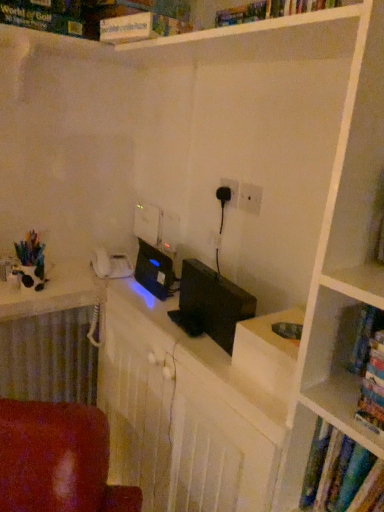
Question: Is white matte puzzle box at upper center placed right next to white textured radiator at lower left?

Choices:
 (A) no
 (B) yes

Answer: (A)

Question: Does white matte puzzle box at upper center have a lesser height compared to white textured radiator at lower left?

Choices:
 (A) no
 (B) yes

Answer: (B)

Question: Can you confirm if white matte puzzle box at upper center is wider than white textured radiator at lower left?

Choices:
 (A) no
 (B) yes

Answer: (B)

Question: Can you confirm if white matte puzzle box at upper center is taller than white textured radiator at lower left?

Choices:
 (A) no
 (B) yes

Answer: (A)

Question: Can white textured radiator at lower left be found inside white matte puzzle box at upper center?

Choices:
 (A) yes
 (B) no

Answer: (B)

Question: From a real-world perspective, is white matte puzzle box at upper center over white textured radiator at lower left?

Choices:
 (A) no
 (B) yes

Answer: (B)

Question: Is white plastic electric outlet at center, acting as the first electric outlet starting from the right, positioned with its back to black plastic electric outlet at center, acting as the second electric outlet starting from the front?

Choices:
 (A) no
 (B) yes

Answer: (A)

Question: Considering the relative sizes of white plastic electric outlet at center, which appears as the 1th electric outlet when viewed from the front, and black plastic electric outlet at center, the second electric outlet from the right, in the image provided, is white plastic electric outlet at center, which appears as the 1th electric outlet when viewed from the front, shorter than black plastic electric outlet at center, the second electric outlet from the right,?

Choices:
 (A) no
 (B) yes

Answer: (B)

Question: From a real-world perspective, is white plastic electric outlet at center, the 2th electric outlet viewed from the left, below black plastic electric outlet at center, positioned as the 1th electric outlet in left-to-right order?

Choices:
 (A) yes
 (B) no

Answer: (A)

Question: Would you say white plastic electric outlet at center, which ranks as the second electric outlet in back-to-front order, is a long distance from black plastic electric outlet at center, positioned as the 1th electric outlet in left-to-right order?

Choices:
 (A) no
 (B) yes

Answer: (A)

Question: From the image's perspective, is white plastic electric outlet at center, which appears as the 1th electric outlet when viewed from the front, under black plastic electric outlet at center, the second electric outlet from the right?

Choices:
 (A) no
 (B) yes

Answer: (B)

Question: Is white plastic electric outlet at center, which ranks as the second electric outlet in back-to-front order, placed right next to black plastic electric outlet at center, acting as the second electric outlet starting from the front?

Choices:
 (A) yes
 (B) no

Answer: (A)

Question: Considering the relative sizes of white matte puzzle box at upper center and white plastic electric outlet at center, acting as the first electric outlet starting from the right, in the image provided, is white matte puzzle box at upper center smaller than white plastic electric outlet at center, acting as the first electric outlet starting from the right,?

Choices:
 (A) no
 (B) yes

Answer: (A)